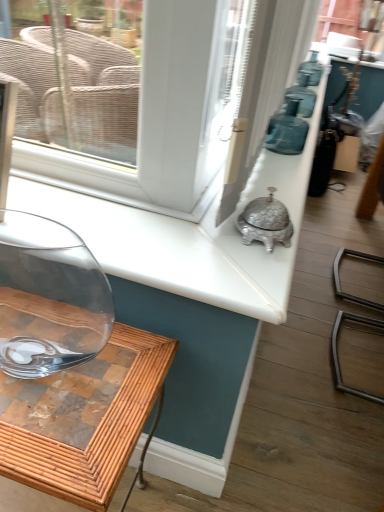
Identify the location of vacant area on top of translucent bamboo table at lower left (from a real-world perspective). This screenshot has height=512, width=384. (61, 368).